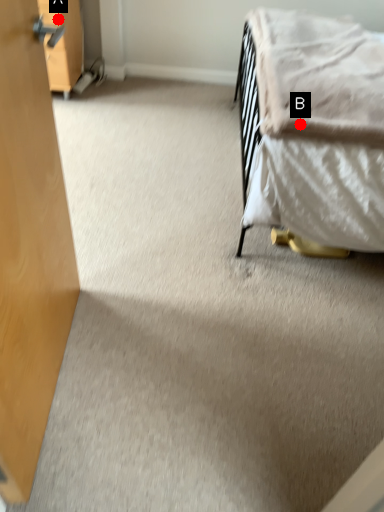
Question: Two points are circled on the image, labeled by A and B beside each circle. Which of the following is the farthest from the observer?

Choices:
 (A) A is further
 (B) B is further

Answer: (A)